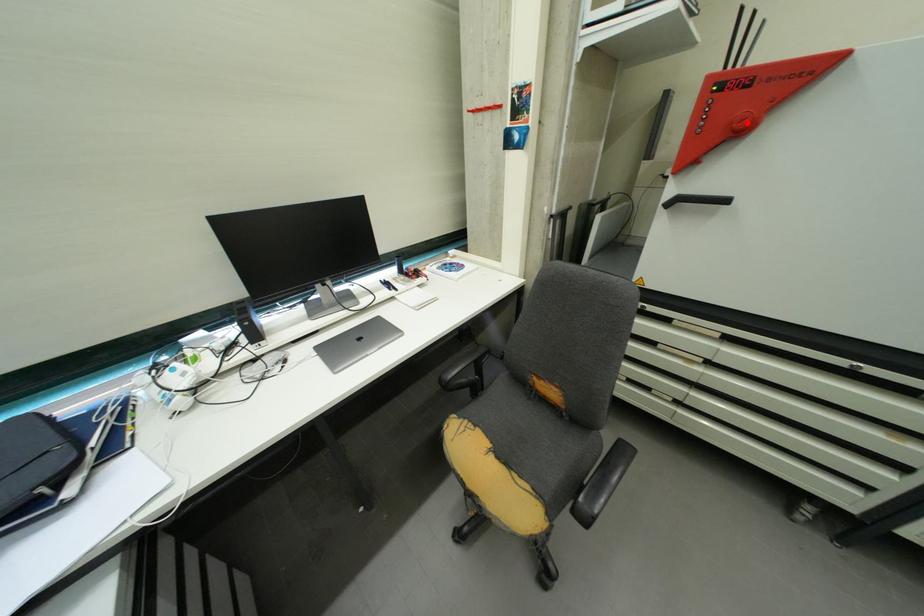
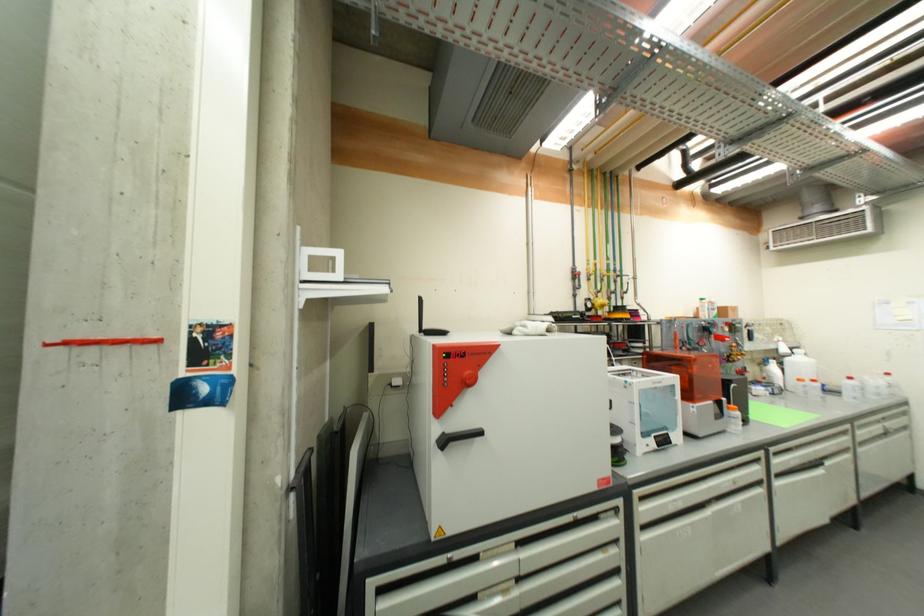
Question: I am providing you with two images of the same scene from different viewpoints. A red point is marked on the first image. Can you still see the location of the red point in image 2?

Choices:
 (A) Yes
 (B) No

Answer: (A)